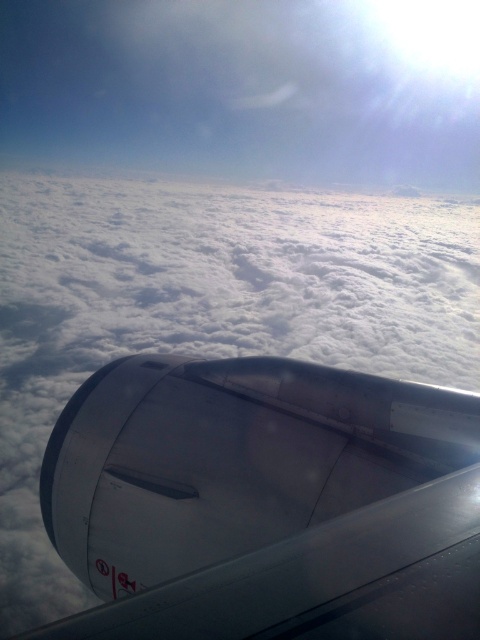
Question: Which point is closer to the camera taking this photo?

Choices:
 (A) (135, 436)
 (B) (169, 492)

Answer: (B)

Question: Which point is closer to the camera taking this photo?

Choices:
 (A) (277, 536)
 (B) (164, 493)

Answer: (A)

Question: Does metallic jet engine at center have a greater width compared to transparent glass airplane window at lower center?

Choices:
 (A) no
 (B) yes

Answer: (B)

Question: From the image, what is the correct spatial relationship of metallic jet engine at center in relation to transparent glass airplane window at lower center?

Choices:
 (A) below
 (B) above

Answer: (B)

Question: Does metallic jet engine at center have a lesser width compared to transparent glass airplane window at lower center?

Choices:
 (A) yes
 (B) no

Answer: (B)

Question: Among these points, which one is farthest from the camera?

Choices:
 (A) (126, 477)
 (B) (83, 413)

Answer: (B)